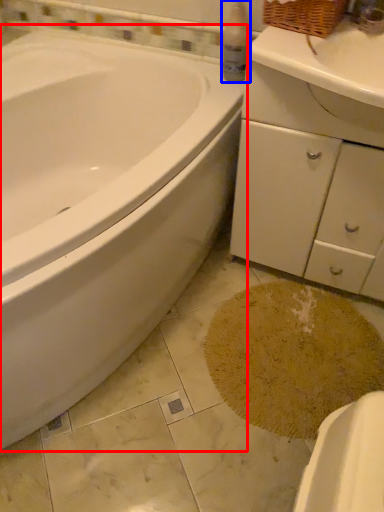
Question: Among these objects, which one is nearest to the camera, bathtub (highlighted by a red box) or cleaning product (highlighted by a blue box)?

Choices:
 (A) bathtub
 (B) cleaning product

Answer: (A)